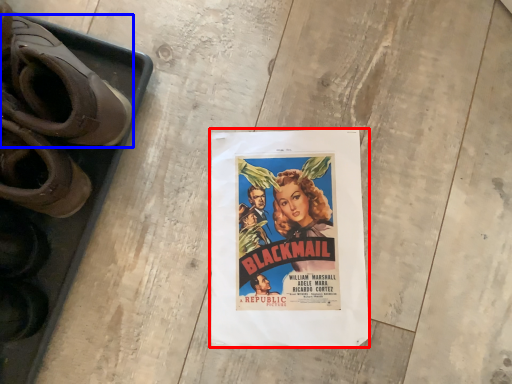
Question: Which of the following is the farthest to the observer, poster (highlighted by a red box) or footwear (highlighted by a blue box)?

Choices:
 (A) poster
 (B) footwear

Answer: (A)